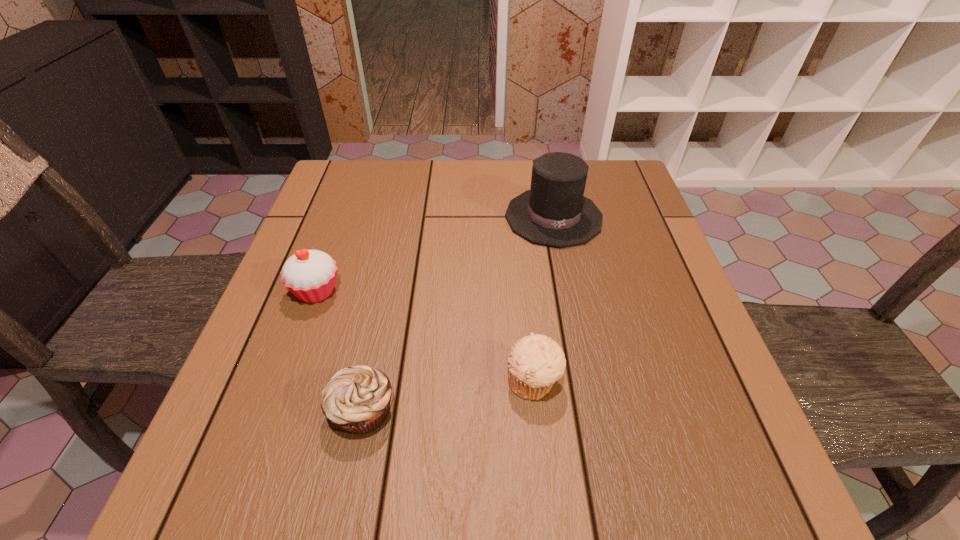
I want to click on free spot between the right muffin and the dress hat, so click(543, 299).

Locate an element on the screen. This screenshot has width=960, height=540. the closest object to the second object from left to right is located at coordinates (310, 275).

At what (x,y) coordinates should I click in order to perform the action: click on the closest object to the second tallest object. Please return your answer as a coordinate pair (x, y). The height and width of the screenshot is (540, 960). Looking at the image, I should click on (357, 399).

The width and height of the screenshot is (960, 540). I want to click on vacant space that satisfies the following two spatial constraints: 1. on the front side of the right muffin; 2. on the right side of the leftmost object, so click(x=284, y=382).